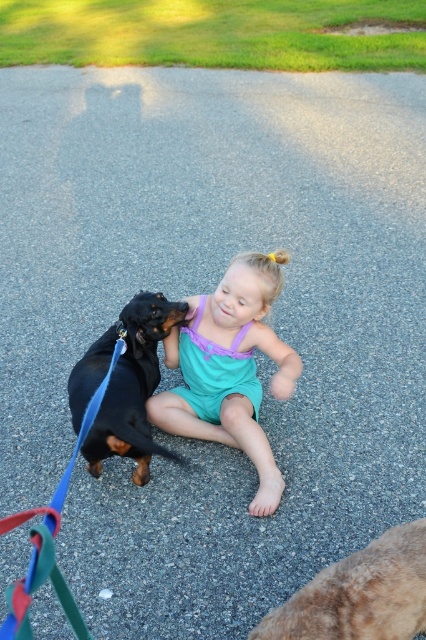
Is matte teal swimsuit at center to the left of black smooth dachshund at center from the viewer's perspective?

In fact, matte teal swimsuit at center is to the right of black smooth dachshund at center.

Who is positioned more to the left, matte teal swimsuit at center or black smooth dachshund at center?

black smooth dachshund at center

Locate an element on the screen. The height and width of the screenshot is (640, 426). matte teal swimsuit at center is located at coordinates (230, 369).

Looking at this image, which is below, brown fluffy dog at lower right or black smooth dachshund at center?

brown fluffy dog at lower right is below.

Can you confirm if brown fluffy dog at lower right is thinner than black smooth dachshund at center?

Incorrect, brown fluffy dog at lower right's width is not less than black smooth dachshund at center's.

Image resolution: width=426 pixels, height=640 pixels. Find the location of `brown fluffy dog at lower right`. brown fluffy dog at lower right is located at coordinates (359, 595).

Between matte teal swimsuit at center and brown fluffy dog at lower right, which one is positioned lower?

Positioned lower is brown fluffy dog at lower right.

Between matte teal swimsuit at center and brown fluffy dog at lower right, which one is positioned higher?

matte teal swimsuit at center is above.

Find the location of a particular element. The width and height of the screenshot is (426, 640). matte teal swimsuit at center is located at coordinates (230, 369).